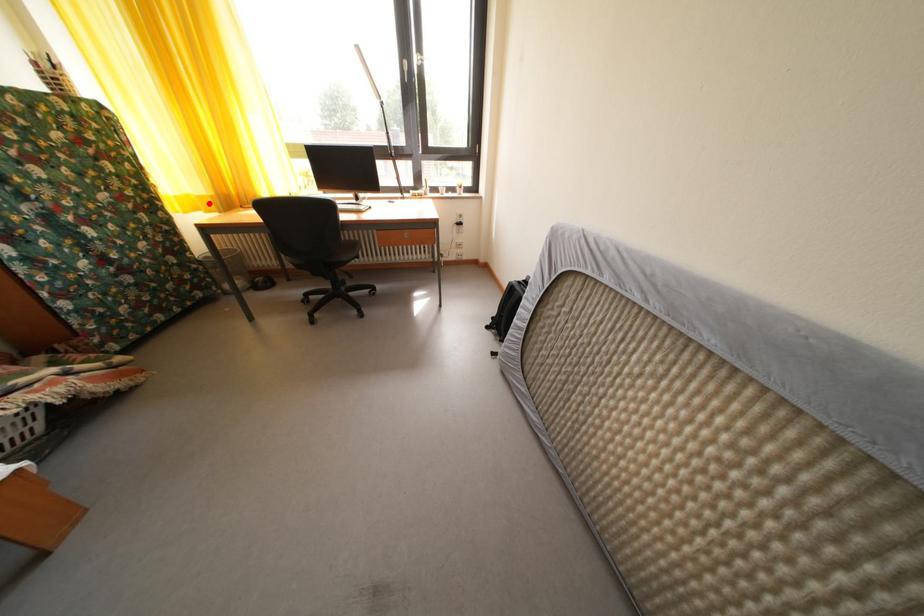
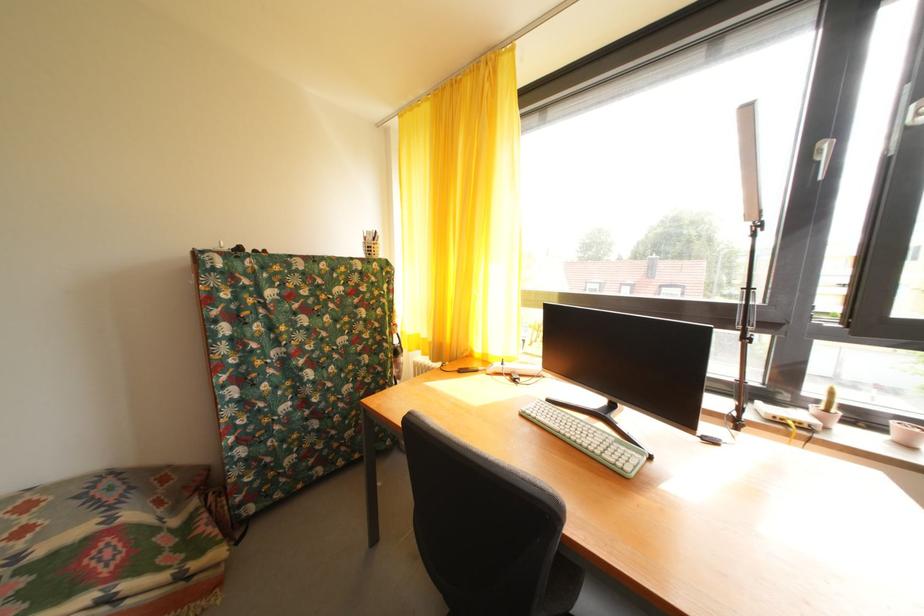
Question: A red point is marked in image1. In image2, is the corresponding 3D point closer to the camera or farther? Reply with the corresponding letter.

Choices:
 (A) The corresponding 3D point is closer.
 (B) The corresponding 3D point is farther.

Answer: (B)